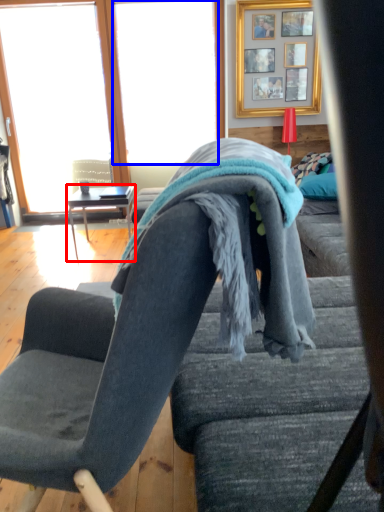
Question: Among these objects, which one is nearest to the camera, table (highlighted by a red box) or window screen (highlighted by a blue box)?

Choices:
 (A) table
 (B) window screen

Answer: (A)